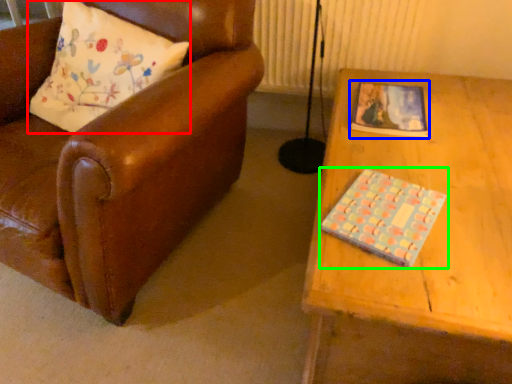
Question: Which object is positioned farthest from pillow (highlighted by a red box)? Select from book (highlighted by a blue box) and book (highlighted by a green box).

Choices:
 (A) book
 (B) book

Answer: (B)